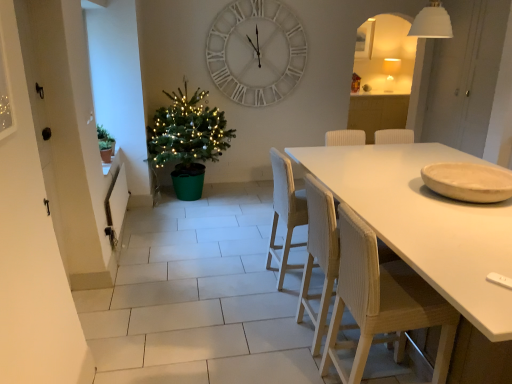
Question: Would you consider green plastic christmas tree at left to be distant from matte white lampshade at upper right?

Choices:
 (A) no
 (B) yes

Answer: (B)

Question: From the image's perspective, would you say green plastic christmas tree at left is shown under matte white lampshade at upper right?

Choices:
 (A) no
 (B) yes

Answer: (B)

Question: Does green plastic christmas tree at left appear on the right side of matte white lampshade at upper right?

Choices:
 (A) yes
 (B) no

Answer: (B)

Question: Is matte white lampshade at upper right inside green plastic christmas tree at left?

Choices:
 (A) yes
 (B) no

Answer: (B)

Question: Does green plastic christmas tree at left come in front of matte white lampshade at upper right?

Choices:
 (A) no
 (B) yes

Answer: (B)

Question: Can you confirm if green plastic christmas tree at left is positioned to the left of matte white lampshade at upper right?

Choices:
 (A) no
 (B) yes

Answer: (B)

Question: Is matte white lampshade at upper right bigger than beige matte plate at right?

Choices:
 (A) no
 (B) yes

Answer: (B)

Question: Is matte white lampshade at upper right to the right of beige matte plate at right from the viewer's perspective?

Choices:
 (A) yes
 (B) no

Answer: (A)

Question: Does matte white lampshade at upper right have a smaller size compared to beige matte plate at right?

Choices:
 (A) no
 (B) yes

Answer: (A)

Question: Can you confirm if matte white lampshade at upper right is wider than beige matte plate at right?

Choices:
 (A) yes
 (B) no

Answer: (B)

Question: From the image's perspective, does matte white lampshade at upper right appear lower than beige matte plate at right?

Choices:
 (A) yes
 (B) no

Answer: (B)

Question: Is matte white lampshade at upper right oriented towards beige matte plate at right?

Choices:
 (A) yes
 (B) no

Answer: (B)

Question: Is green plastic christmas tree at left at the left side of wooden chair at center, positioned as the second chair in back-to-front order?

Choices:
 (A) no
 (B) yes

Answer: (B)